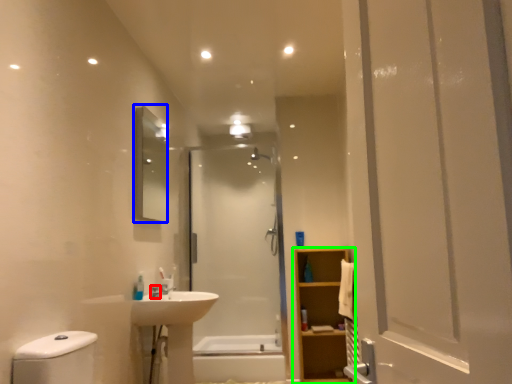
Question: Which object is the closest to the plumbing fixture (highlighted by a red box)? Choose among these: mirror (highlighted by a blue box) or bathroom cabinet (highlighted by a green box).

Choices:
 (A) mirror
 (B) bathroom cabinet

Answer: (A)